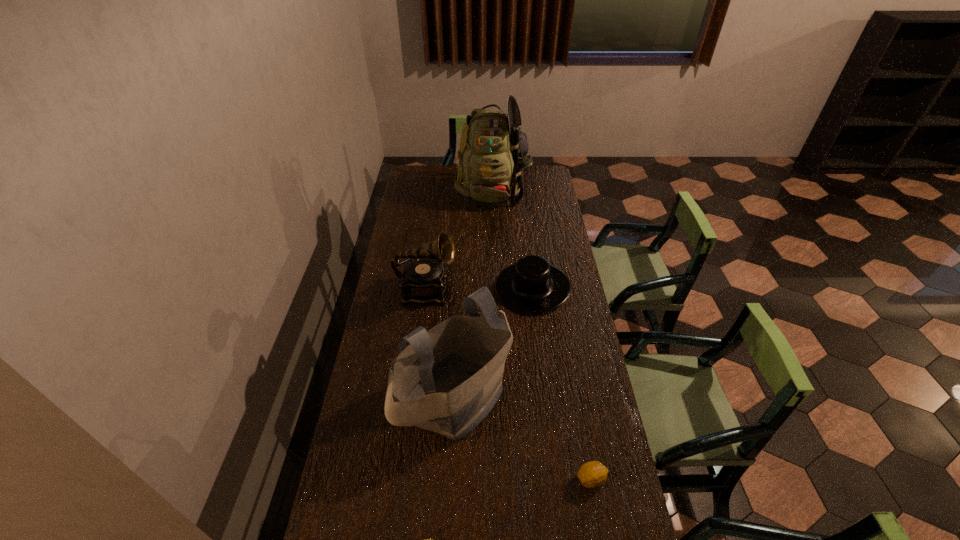
Locate an element on the screen. object that is at the far right corner is located at coordinates (493, 151).

In order to click on free spot at the left edge of the desktop in this screenshot , I will do `click(379, 303)`.

In the image, there is a desktop. Where is `vacant space at the right edge`? The width and height of the screenshot is (960, 540). vacant space at the right edge is located at coordinates (564, 343).

Find the location of a particular element. The image size is (960, 540). vacant space at the far right corner of the desktop is located at coordinates (544, 170).

In order to click on empty space between the third nearest object and the backpack in this screenshot , I will do `click(473, 293)`.

This screenshot has height=540, width=960. In order to click on free point between the farthest object and the fourth farthest object in this screenshot , I will do `click(473, 293)`.

Locate an element on the screen. This screenshot has height=540, width=960. free spot between the third shortest object and the backpack is located at coordinates (513, 238).

Find the location of `object that is the second closest to the farthest object`. object that is the second closest to the farthest object is located at coordinates [x=424, y=279].

Identify which object is located as the fourth nearest to the phonograph record. Please provide its 2D coordinates. Your answer should be formatted as a tuple, i.e. [(x, y)], where the tuple contains the x and y coordinates of a point satisfying the conditions above.

[(592, 474)]

Locate an element on the screen. vacant space that satisfies the following two spatial constraints: 1. on the back side of the shopping bag; 2. on the left side of the dress hat is located at coordinates (461, 287).